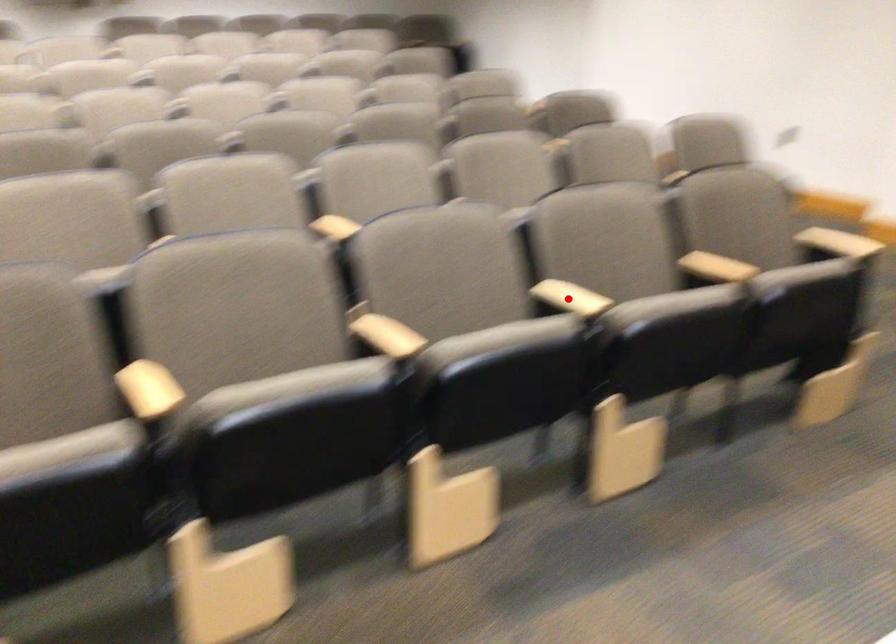
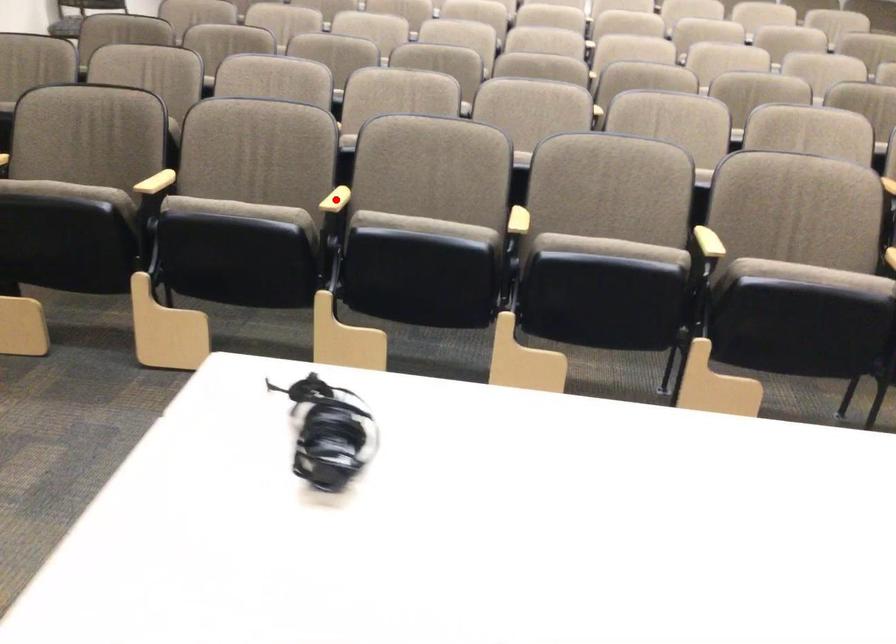
I am providing you with two images of the same scene from different viewpoints. A red point is marked on the first image and another point is marked on the second image. Does the point marked in image1 correspond to the same location as the one in image2?

No